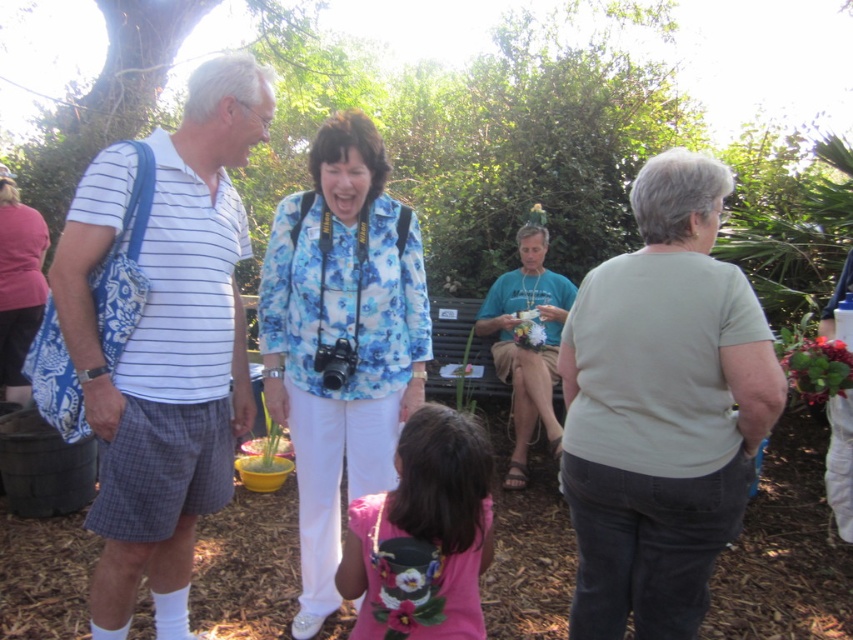
Question: In this image, where is floral fabric shirt at center located relative to blue floral shirt at center?

Choices:
 (A) above
 (B) below

Answer: (A)

Question: Among these objects, which one is farthest from the camera?

Choices:
 (A) blue floral shirt at center
 (B) matte blue bag at left
 (C) white striped shirt at left

Answer: (B)

Question: Is floral fabric shirt at center positioned before matte blue bag at left?

Choices:
 (A) no
 (B) yes

Answer: (B)

Question: From the image, what is the correct spatial relationship of blue floral shirt at center in relation to matte blue bag at left?

Choices:
 (A) right
 (B) left

Answer: (A)

Question: Estimate the real-world distances between objects in this image. Which object is farther from the blue floral shirt at center?

Choices:
 (A) white striped shirt at left
 (B) floral fabric shirt at center
 (C) matte blue bag at left
 (D) light gray cotton shirt at center

Answer: (C)

Question: Which point is farther to the camera?

Choices:
 (A) white striped shirt at left
 (B) blue floral shirt at center
 (C) light gray cotton shirt at center
 (D) matte blue bag at left

Answer: (D)